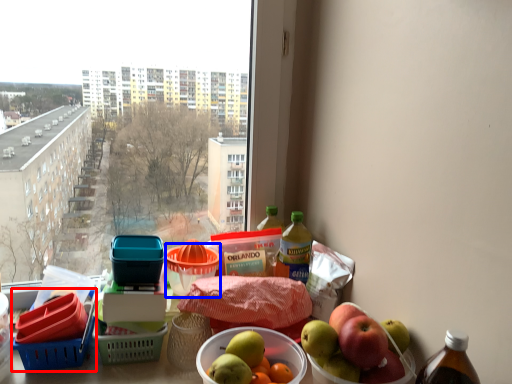
Question: Among these objects, which one is nearest to the camera, basket (highlighted by a red box) or basket (highlighted by a blue box)?

Choices:
 (A) basket
 (B) basket

Answer: (A)